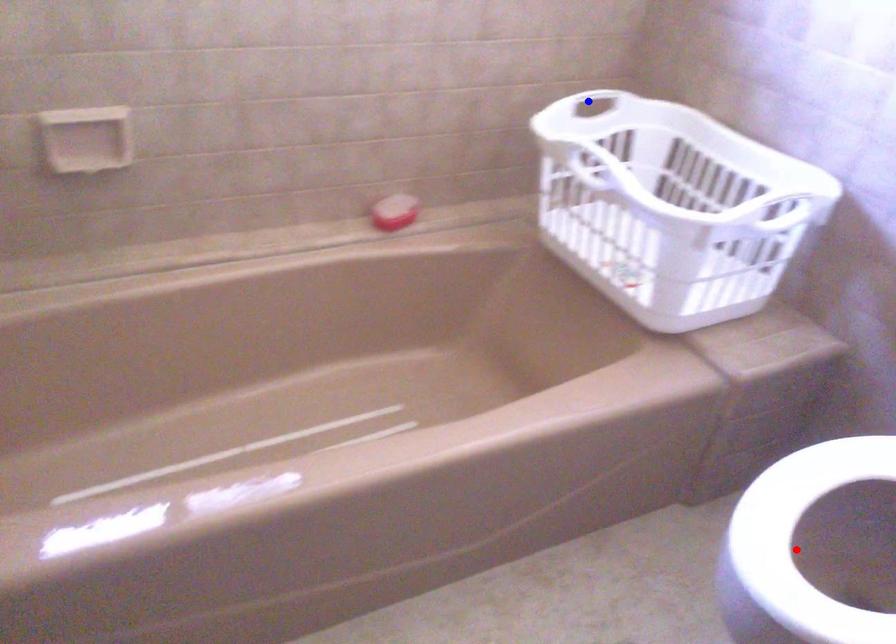
Question: Two points are marked on the image. Which point is closer to the camera?

Choices:
 (A) Blue point is closer.
 (B) Red point is closer.

Answer: (B)